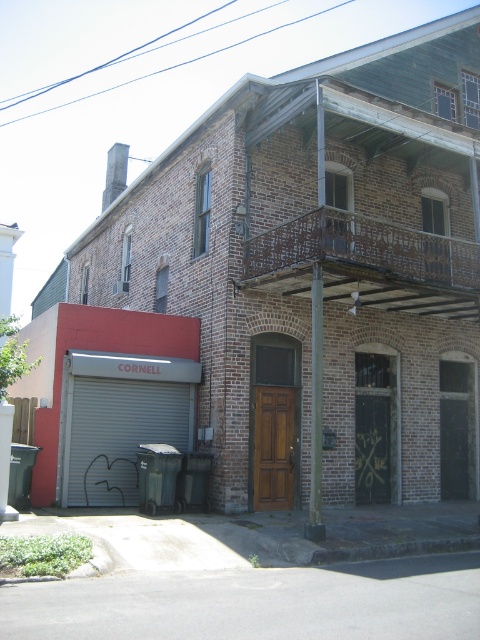
Question: Can you confirm if brown wood door at center is positioned above metallic pole at center?

Choices:
 (A) no
 (B) yes

Answer: (A)

Question: Which point is closer to the camera?

Choices:
 (A) (276, 433)
 (B) (315, 348)
 (C) (83, 454)

Answer: (B)

Question: Which object is positioned farthest from the metallic pole at center?

Choices:
 (A) brown wood door at center
 (B) gray metallic garage door at lower left

Answer: (B)

Question: Which object is positioned farthest from the brown wood door at center?

Choices:
 (A) metallic pole at center
 (B) gray metallic garage door at lower left

Answer: (B)

Question: Can you confirm if gray metallic garage door at lower left is positioned above brown wood door at center?

Choices:
 (A) yes
 (B) no

Answer: (A)

Question: Is gray metallic garage door at lower left positioned before metallic pole at center?

Choices:
 (A) yes
 (B) no

Answer: (B)